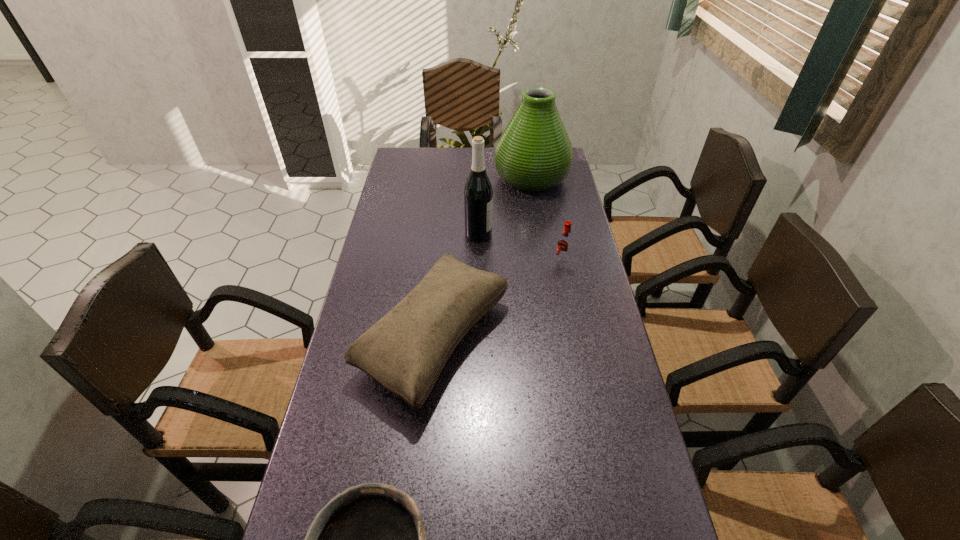
At what (x,y) coordinates should I click in order to perform the action: click on wine bottle. Please return your answer as a coordinate pair (x, y). Image resolution: width=960 pixels, height=540 pixels. Looking at the image, I should click on (478, 195).

You are a GUI agent. You are given a task and a screenshot of the screen. Output one action in this format:
    pyautogui.click(x=<x>, y=<y>)
    Task: Click on the farthest object
    The height and width of the screenshot is (540, 960).
    Given the screenshot: What is the action you would take?
    pyautogui.click(x=534, y=153)

Where is `root beer`? This screenshot has height=540, width=960. root beer is located at coordinates (564, 245).

I want to click on cushion, so click(405, 351).

You are a GUI agent. You are given a task and a screenshot of the screen. Output one action in this format:
    pyautogui.click(x=<x>, y=<y>)
    Task: Click on the blank area located 0.270m on the label of the wine bottle
    This screenshot has width=960, height=540.
    Given the screenshot: What is the action you would take?
    pyautogui.click(x=569, y=234)

Where is `blank area located on the left of the vase`? blank area located on the left of the vase is located at coordinates (446, 178).

In order to click on vacant space located on the left of the third nearest object in this screenshot , I will do `click(456, 263)`.

The width and height of the screenshot is (960, 540). I want to click on vacant space located on the back of the cushion, so click(445, 220).

This screenshot has height=540, width=960. I want to click on object that is positioned at the far edge, so click(x=534, y=153).

I want to click on object present at the left edge, so click(x=405, y=351).